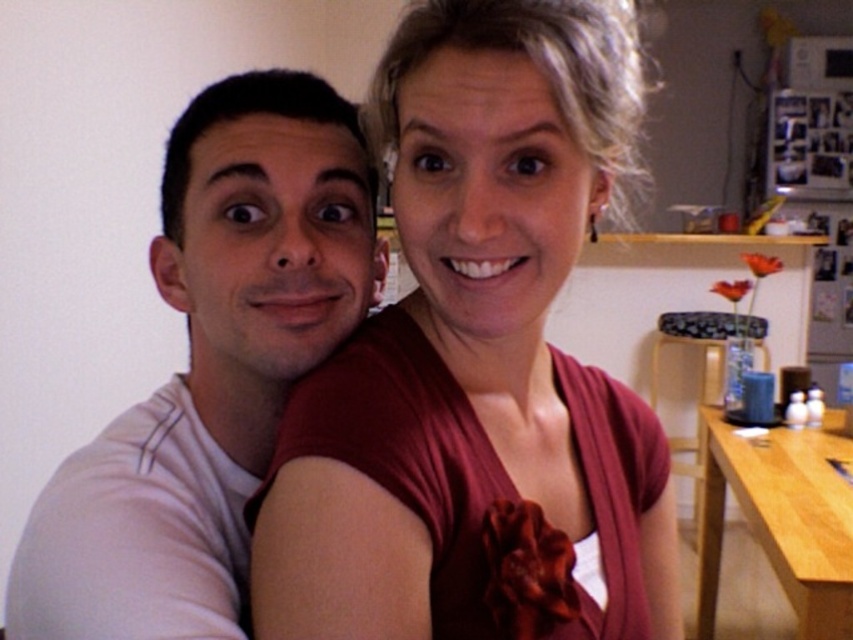
In the image, there are two points labeled as point 1 at coordinates point 1 at coordinates point [306,362] and point 2 at coordinates point [698,515]. Which point is closer to the camera?

Point 1 at coordinates point [306,362] is closer to the camera because it is in front of point 2 at coordinates point [698,515].